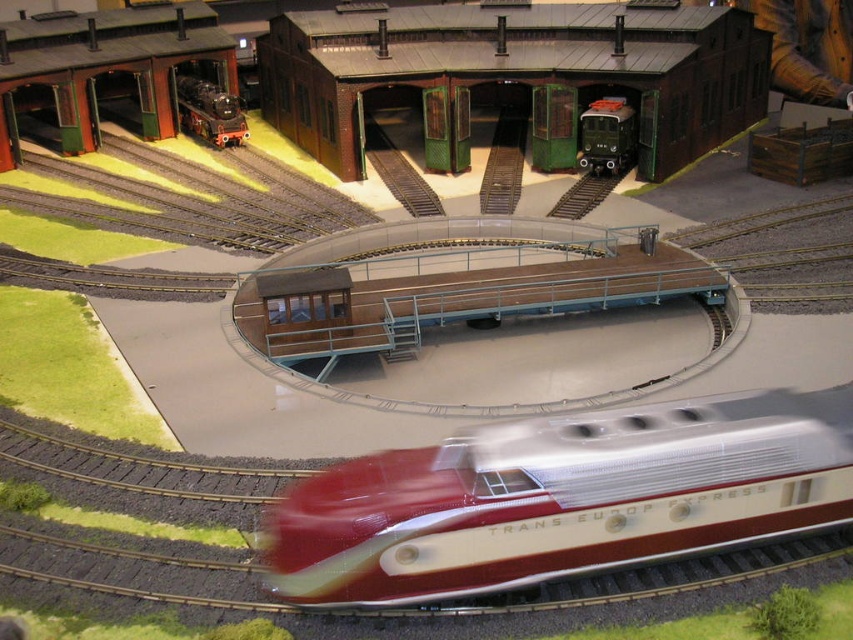
You are an engineer who needs to determine which train has a larger capacity for passengers. Based on the scene, which train between the metallic silver train at center and the green matte train at center can carry more passengers?

The metallic silver train at center is bigger than the green matte train at center, so it can carry more passengers.

You are a toy engineer designing a new track layout for the model railway. You need to place a new signal light between the metallic silver train at center and the green matte train at center. What is the minimum distance the signal light should be placed from each train to ensure it is equidistant from both?

The minimum distance the signal light should be placed from each train to ensure it is equidistant from both is half of the distance between them, which is 10.78 feet.